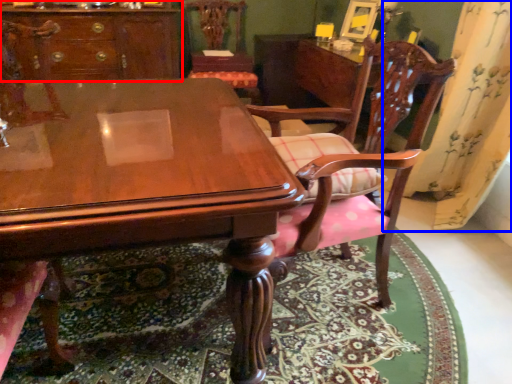
Question: Among these objects, which one is nearest to the camera, cabinetry (highlighted by a red box) or curtain (highlighted by a blue box)?

Choices:
 (A) cabinetry
 (B) curtain

Answer: (B)